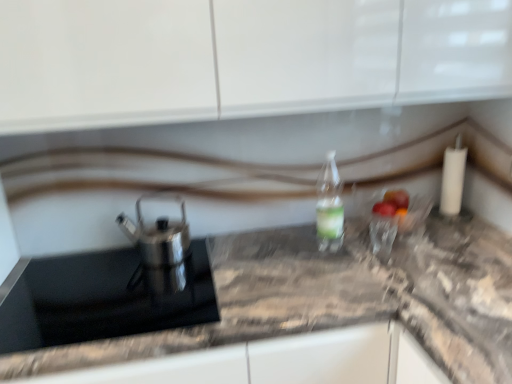
Where is `vacant space in front of clear plastic bottle at center`? vacant space in front of clear plastic bottle at center is located at coordinates (339, 272).